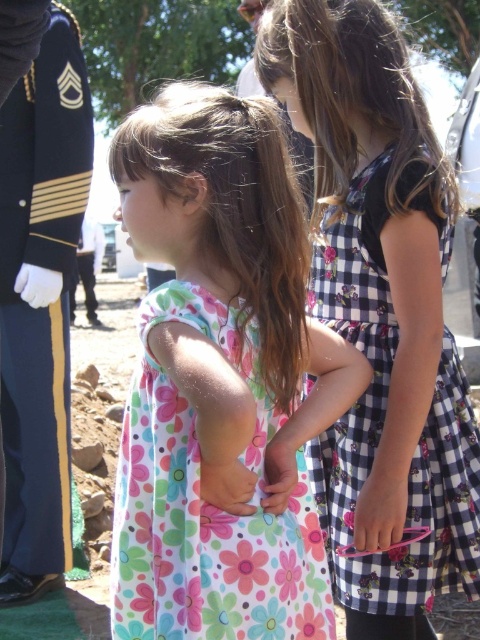
You are a fashion designer observing two outfits in the image. The first is the floral cotton dress at center, and the second is the dark blue wool uniform at left. Which outfit is shorter in length?

The floral cotton dress at center is shorter than the dark blue wool uniform at left.

Two girls are standing in an outdoor setting. The first girl is wearing a floral cotton dress at center. The second girl is standing behind and to the right of the first girl. How far apart are they?

They are 5.11 feet apart.